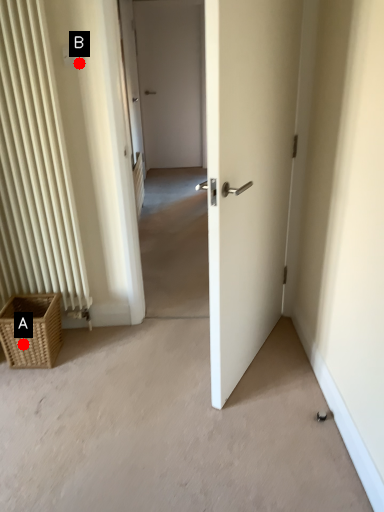
Question: Two points are circled on the image, labeled by A and B beside each circle. Among these points, which one is farthest from the camera?

Choices:
 (A) A is further
 (B) B is further

Answer: (A)